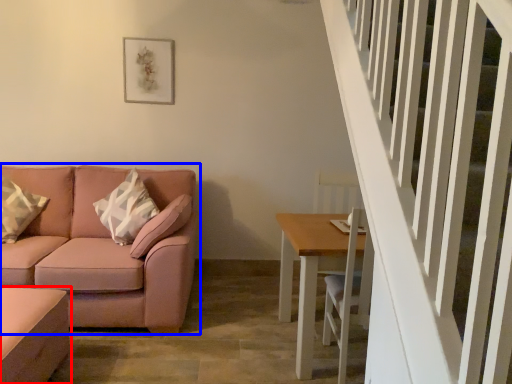
Question: Which object is closer to the camera taking this photo, table (highlighted by a red box) or studio couch (highlighted by a blue box)?

Choices:
 (A) table
 (B) studio couch

Answer: (A)